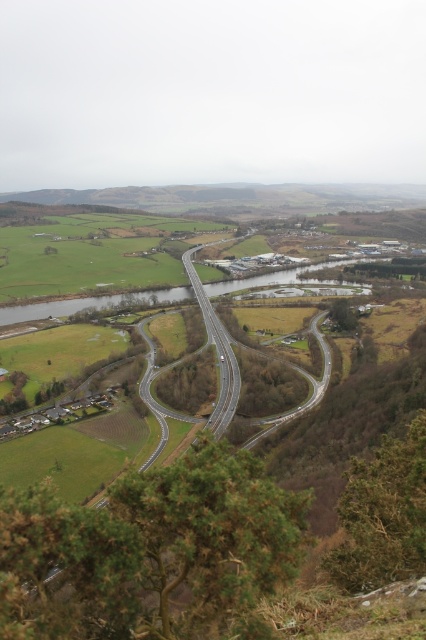
From the picture: You are a drone operator flying over a rural area and need to deliver a package to a location near the green grassy river at center. Your drone has a limited battery and must stay close to the smooth asphalt highway at center for navigation. Based on the scene, which side of the highway should you fly towards to reach the river efficiently?

The green grassy river at center is positioned on the right side of the smooth asphalt highway at center. Therefore, to reach the river efficiently, you should fly towards the right side of the highway.